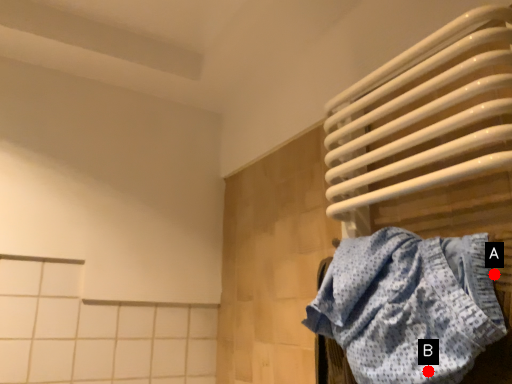
Question: Two points are circled on the image, labeled by A and B beside each circle. Which point appears closest to the camera in this image?

Choices:
 (A) A is closer
 (B) B is closer

Answer: (B)